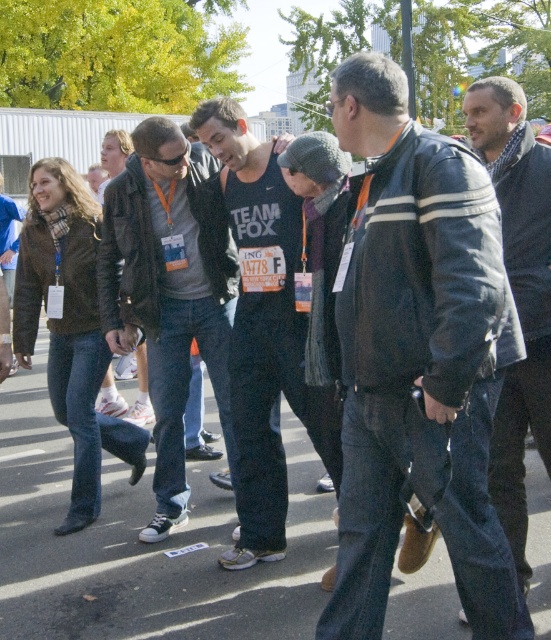
You are organizing a charity event and need to decide which jacket to display. The matte black jacket at center and the dark gray jacket at center are both options. Based on their sizes, which one would be more suitable for a mannequin that requires a larger garment?

The dark gray jacket at center is larger than the matte black jacket at center, so it would be more suitable for a mannequin that requires a larger garment.

Consider the image. You are a photographer at the event and want to capture a group photo of the leather jacket at center and the matte black jacket at center. If you want to ensure both jackets are fully visible in the frame, which jacket should you position closer to the camera?

The leather jacket at center is narrower than the matte black jacket at center, so positioning the leather jacket at center closer to the camera will ensure both jackets fit within the frame while maintaining visibility.